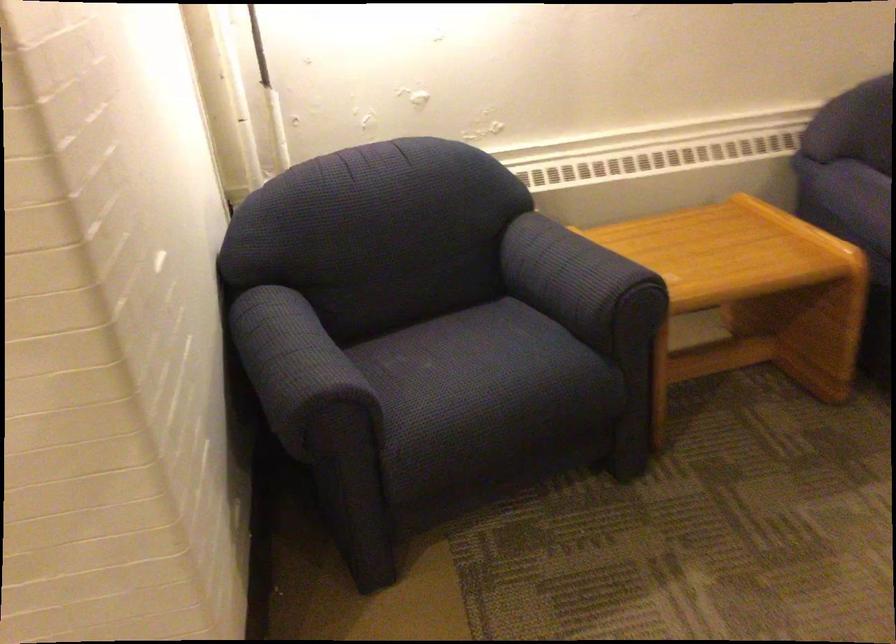
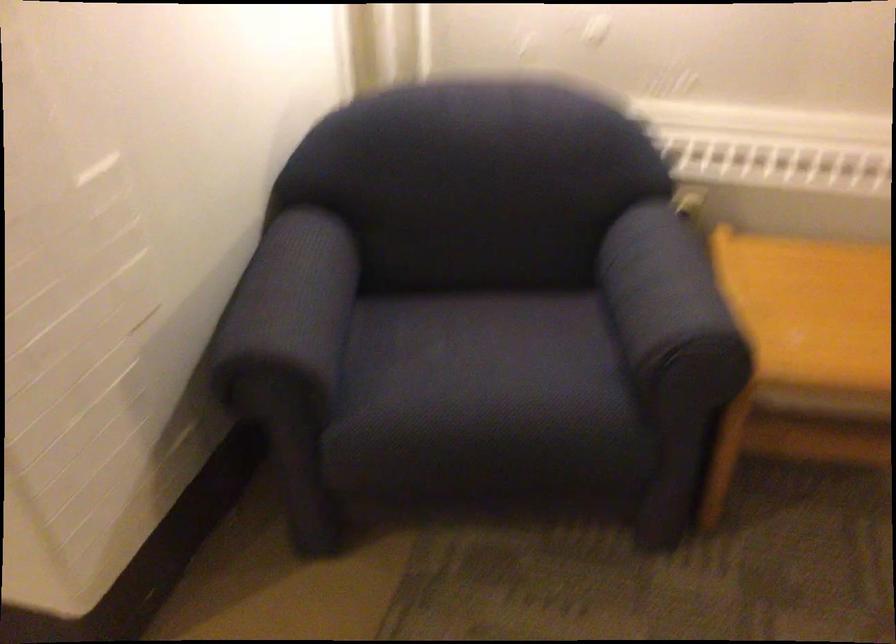
Question: Based on the continuous images, in which direction is the camera rotating? Reply with the corresponding letter.

Choices:
 (A) Left
 (B) Right
 (C) Up
 (D) Down

Answer: (A)